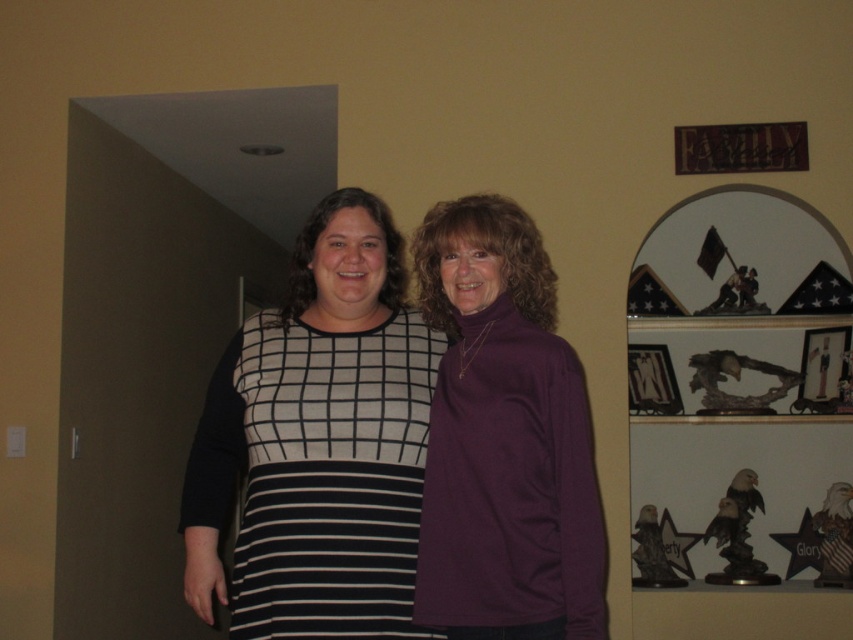
You are standing in a room and want to reach a point that is exactly 1.91 meters away from you. Can you confirm if the point at coordinates point (585, 417) is exactly 1.91 meters away from your current position?

Yes, the point at coordinates point (585, 417) is exactly 1.91 meters away from the viewer.

You are an interior designer working on a project and need to place a new decorative item on the shelf in the scene. The shelf has limited space. You want to place the new item at the exact position where the purple matte turtleneck sweater at right is currently located. Is this position available? Please check the coordinates provided in the description.

The purple matte turtleneck sweater at right is located at coordinates point (503,438), so the position is currently occupied by the purple matte turtleneck sweater at right and is not available for placing the new item.

Consider the image. Please provide the 2D coordinates of the black and white striped dress at center in the image. The coordinates should be in the format of a tuple with two decimal numbers separated by a comma, enclosed in parentheses. The first number represents the x coordinate, and the second number represents the y coordinate. The coordinate system is normalized such that the origin is at the bottom left corner of the image, with x increasing to the right and y increasing upward. The maximum x and y values are both 1.0.

The 2D coordinates of the black and white striped dress at center are at point (329, 476).